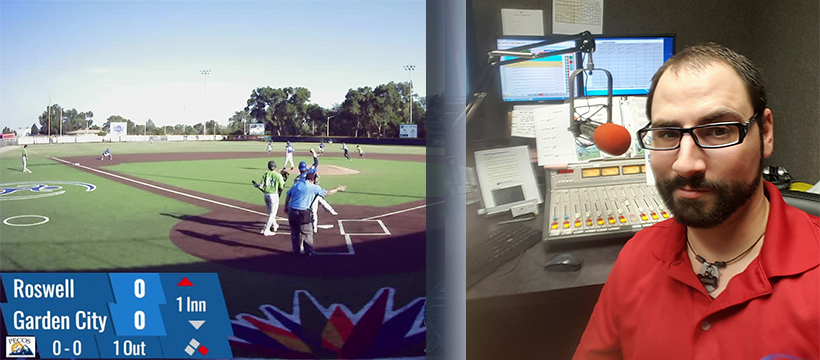
Locate an element on the screen. mouse is located at coordinates (563, 255).